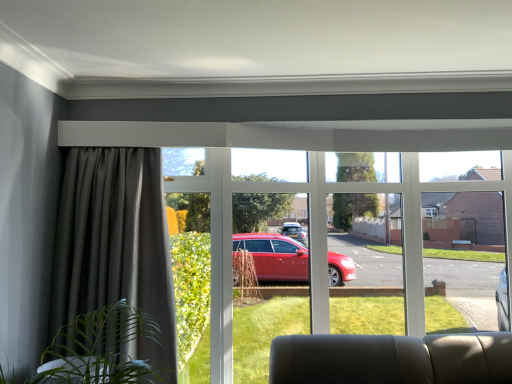
Question: Is clear glass window at center far away from dark grey textured curtain at left?

Choices:
 (A) yes
 (B) no

Answer: (B)

Question: Is clear glass window at center bigger than dark grey textured curtain at left?

Choices:
 (A) no
 (B) yes

Answer: (B)

Question: Would you say clear glass window at center contains dark grey textured curtain at left?

Choices:
 (A) yes
 (B) no

Answer: (B)

Question: Considering the relative positions of clear glass window at center and dark grey textured curtain at left in the image provided, is clear glass window at center in front of dark grey textured curtain at left?

Choices:
 (A) yes
 (B) no

Answer: (B)

Question: Does clear glass window at center have a smaller size compared to dark grey textured curtain at left?

Choices:
 (A) yes
 (B) no

Answer: (B)

Question: Is clear glass window at center to the right of dark grey textured curtain at left from the viewer's perspective?

Choices:
 (A) no
 (B) yes

Answer: (B)

Question: Are dark grey textured curtain at left and clear glass window at center making contact?

Choices:
 (A) no
 (B) yes

Answer: (A)

Question: From the image's perspective, would you say dark grey textured curtain at left is shown under clear glass window at center?

Choices:
 (A) yes
 (B) no

Answer: (B)

Question: Does dark grey textured curtain at left appear on the left side of clear glass window at center?

Choices:
 (A) no
 (B) yes

Answer: (B)

Question: From a real-world perspective, is dark grey textured curtain at left physically above clear glass window at center?

Choices:
 (A) yes
 (B) no

Answer: (A)

Question: Is there a large distance between dark grey textured curtain at left and clear glass window at center?

Choices:
 (A) yes
 (B) no

Answer: (B)

Question: Considering the relative sizes of dark grey textured curtain at left and clear glass window at center in the image provided, is dark grey textured curtain at left shorter than clear glass window at center?

Choices:
 (A) yes
 (B) no

Answer: (A)

Question: In terms of size, does dark grey textured curtain at left appear bigger or smaller than clear glass window at center?

Choices:
 (A) small
 (B) big

Answer: (A)